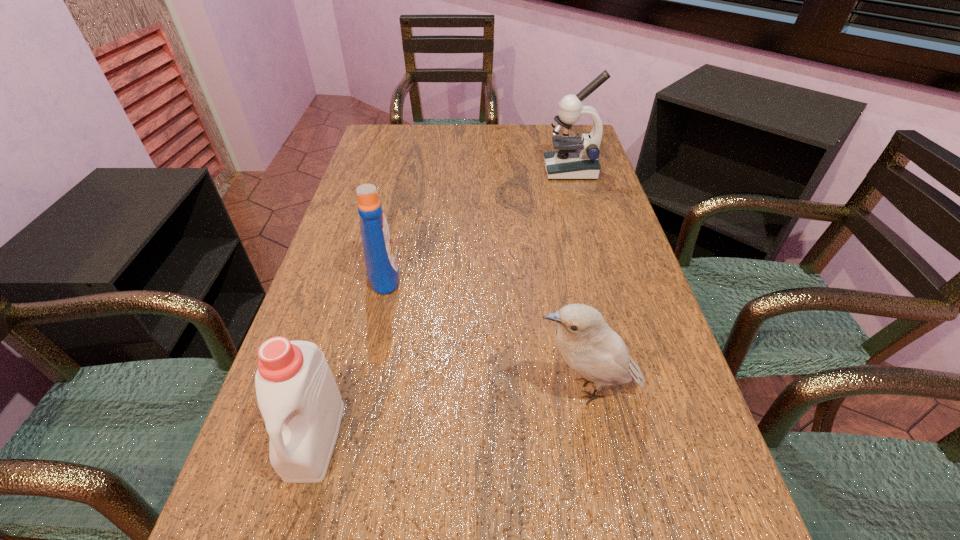
This screenshot has height=540, width=960. What are the coordinates of `free space located 0.240m at the beak of the bird` in the screenshot? It's located at (402, 388).

I want to click on microscope present at the right edge, so click(575, 158).

Where is `bird present at the right edge`? bird present at the right edge is located at coordinates (585, 342).

Where is `vacant region at the far edge of the desktop`? vacant region at the far edge of the desktop is located at coordinates (454, 148).

In the image, there is a desktop. Where is `free region at the left edge`? This screenshot has height=540, width=960. free region at the left edge is located at coordinates (345, 216).

Find the location of a particular element. The height and width of the screenshot is (540, 960). vacant point at the right edge is located at coordinates (644, 539).

Where is `vacant region at the far left corner of the desktop`? The image size is (960, 540). vacant region at the far left corner of the desktop is located at coordinates (413, 156).

At what (x,y) coordinates should I click in order to perform the action: click on vacant point located between the microscope and the bird. Please return your answer as a coordinate pair (x, y). This screenshot has width=960, height=540. Looking at the image, I should click on click(579, 279).

Find the location of a particular element. The height and width of the screenshot is (540, 960). empty space between the third nearest object and the farthest object is located at coordinates 477,222.

At what (x,y) coordinates should I click in order to perform the action: click on vacant area between the nearer detergent and the microscope. Please return your answer as a coordinate pair (x, y). Looking at the image, I should click on (443, 304).